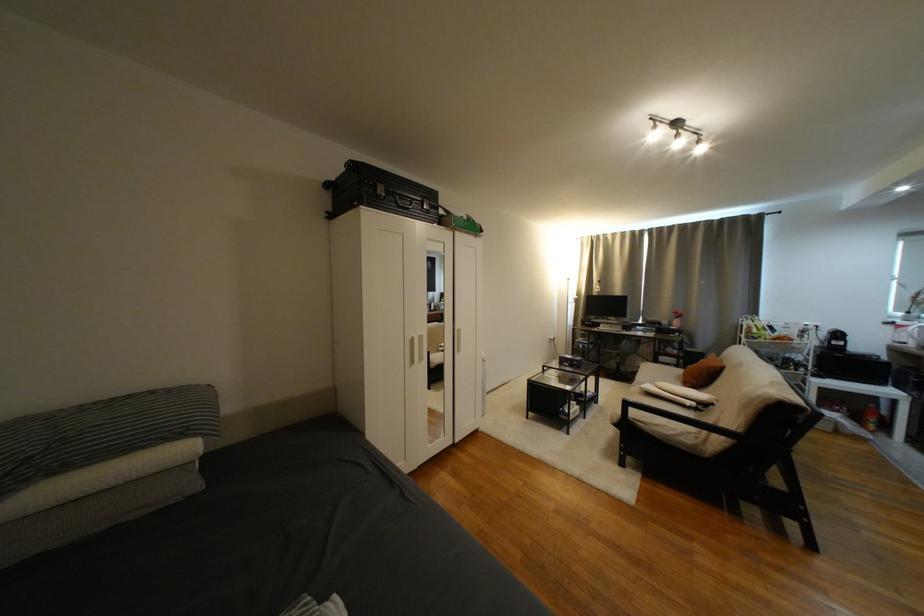
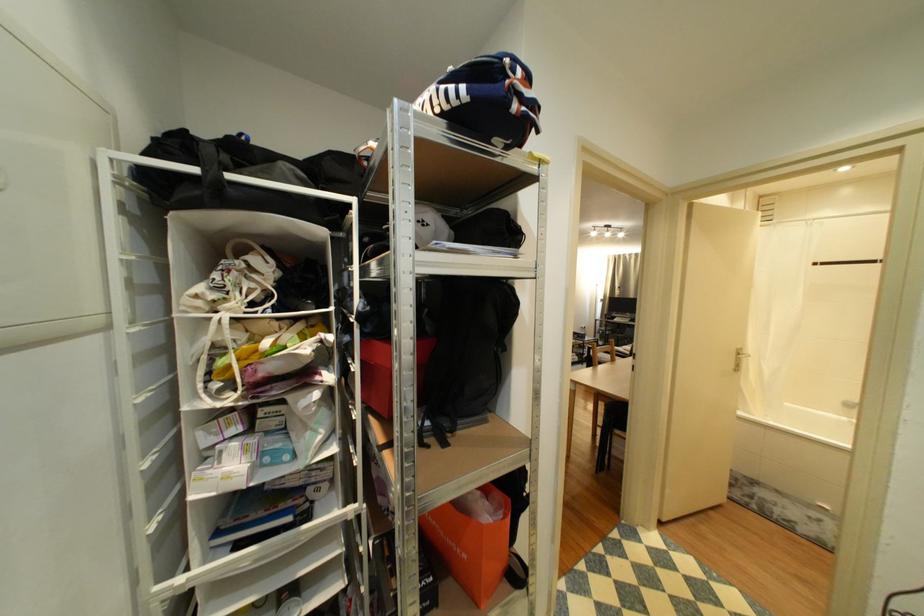
Question: In a continuous first-person perspective shot, in which direction is the camera moving?

Choices:
 (A) Left
 (B) Right
 (C) Forward
 (D) Backward

Answer: (D)